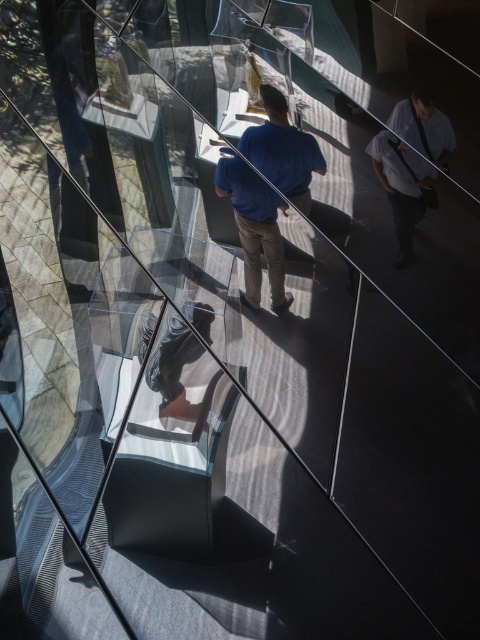
Between blue cotton shirt at center and light blue shirt at right, which one is positioned lower?

Positioned lower is light blue shirt at right.

Is blue cotton shirt at center above light blue shirt at right?

Yes.

This screenshot has height=640, width=480. What do you see at coordinates (254, 227) in the screenshot?
I see `blue cotton shirt at center` at bounding box center [254, 227].

Find the location of a particular element. blue cotton shirt at center is located at coordinates (254, 227).